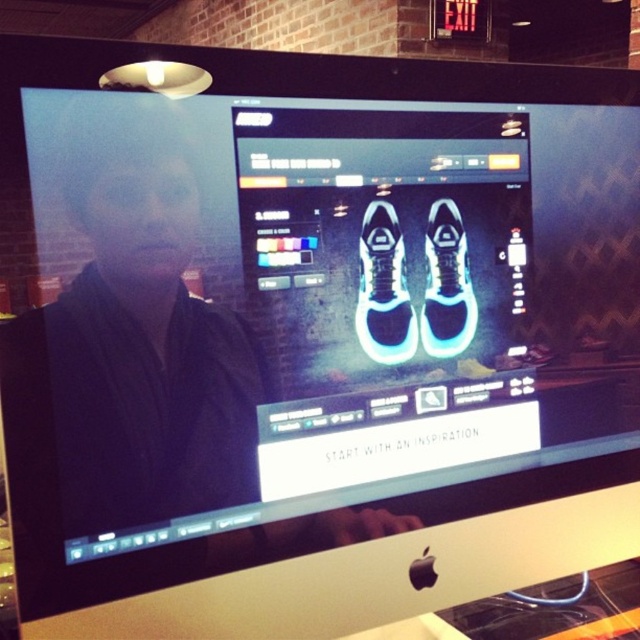
Question: Which point appears closest to the camera in this image?

Choices:
 (A) (356, 316)
 (B) (454, 252)

Answer: (A)

Question: Is white matte sneakers at center further to the viewer compared to white matte sneaker at center?

Choices:
 (A) yes
 (B) no

Answer: (B)

Question: Observing the image, what is the correct spatial positioning of white matte sneakers at center in reference to white matte sneaker at center?

Choices:
 (A) right
 (B) left

Answer: (B)

Question: Can you confirm if white matte sneakers at center is positioned to the right of white matte sneaker at center?

Choices:
 (A) yes
 (B) no

Answer: (B)

Question: Which object appears farthest from the camera in this image?

Choices:
 (A) white matte sneaker at center
 (B) white matte sneakers at center

Answer: (A)